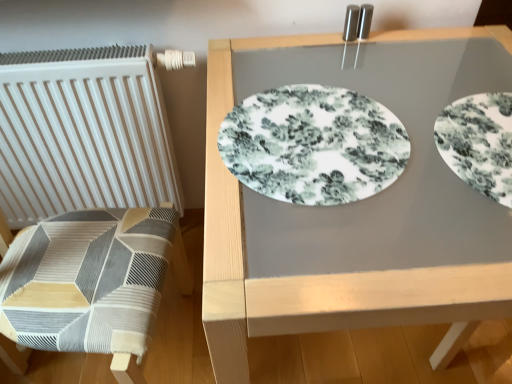
What are the coordinates of `blank space situated above white floral plate at center, the 1th plate in the left-to-right sequence (from a real-world perspective)` in the screenshot? It's located at (302, 131).